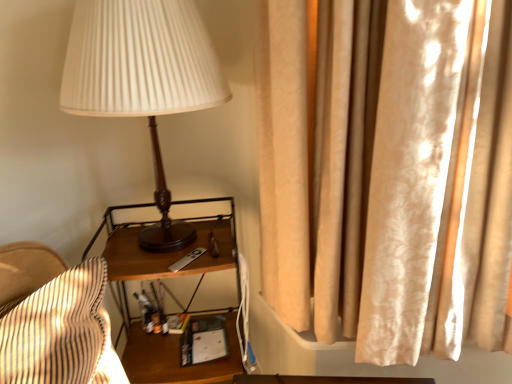
Question: Considering the positions of matte wood lamp at center and wooden nightstand at center in the image, is matte wood lamp at center wider or thinner than wooden nightstand at center?

Choices:
 (A) wide
 (B) thin

Answer: (A)

Question: From a real-world perspective, is matte wood lamp at center physically located above or below wooden nightstand at center?

Choices:
 (A) above
 (B) below

Answer: (A)

Question: Which is farther from the silky beige curtain at right?

Choices:
 (A) matte wood lamp at center
 (B) wooden nightstand at center

Answer: (B)

Question: Based on their relative distances, which object is farther from the matte wood lamp at center?

Choices:
 (A) wooden nightstand at center
 (B) silky beige curtain at right

Answer: (A)